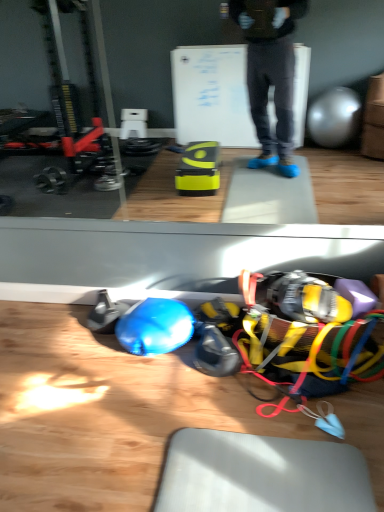
This screenshot has height=512, width=384. In order to click on free space in front of blue glossy helmet at lower left in this screenshot , I will do `click(148, 391)`.